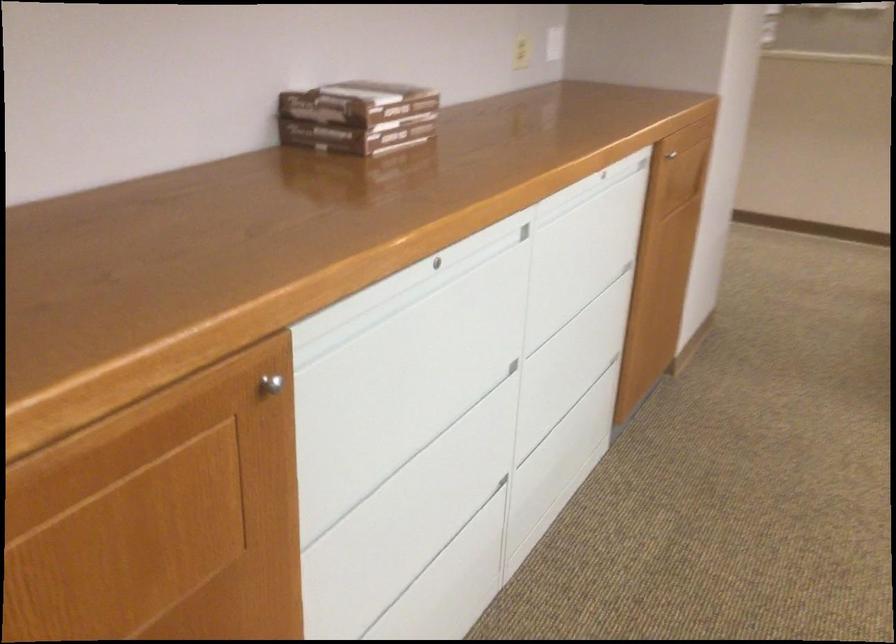
Image resolution: width=896 pixels, height=644 pixels. What do you see at coordinates (270, 383) in the screenshot?
I see `the silver cabinet knob` at bounding box center [270, 383].